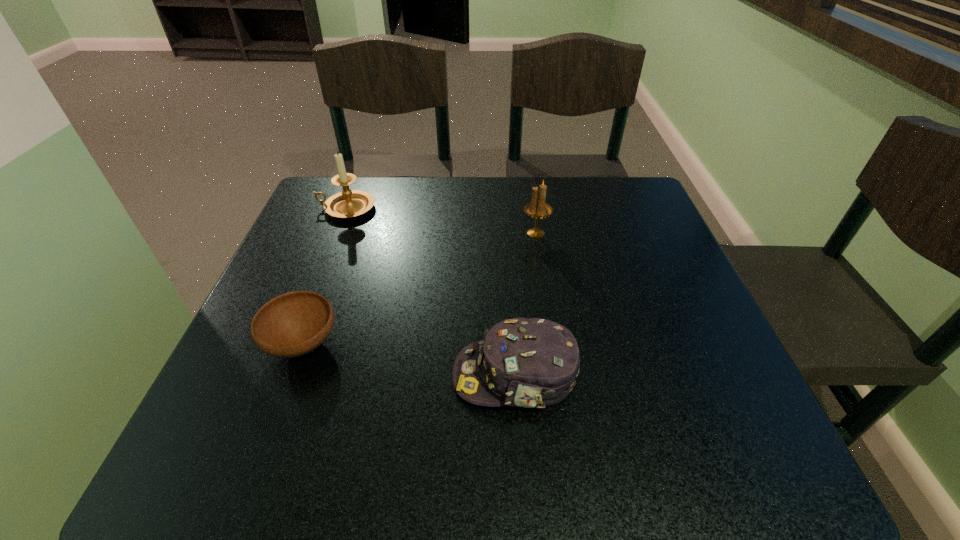
Find the location of `free space that is in between the shortest object and the third tallest object`. free space that is in between the shortest object and the third tallest object is located at coordinates (409, 360).

This screenshot has width=960, height=540. Find the location of `object that is the second closest to the headwear`. object that is the second closest to the headwear is located at coordinates (537, 208).

Select which object is the closest to the nearer candle holder. Please provide its 2D coordinates. Your answer should be formatted as a tuple, i.e. [(x, y)], where the tuple contains the x and y coordinates of a point satisfying the conditions above.

[(532, 363)]

You are a GUI agent. You are given a task and a screenshot of the screen. Output one action in this format:
    pyautogui.click(x=<x>, y=<y>)
    Task: Click on the free space that satisfies the following two spatial constraints: 1. with a handle on the side of the left candle holder; 2. on the left side of the nearer candle holder
    The width and height of the screenshot is (960, 540).
    Given the screenshot: What is the action you would take?
    pyautogui.click(x=336, y=233)

This screenshot has width=960, height=540. What are the coordinates of `free spot that satisfies the following two spatial constraints: 1. on the back side of the shortest object; 2. on the right side of the right candle holder` in the screenshot? It's located at (344, 233).

You are a GUI agent. You are given a task and a screenshot of the screen. Output one action in this format:
    pyautogui.click(x=<x>, y=<y>)
    Task: Click on the free location that satisfies the following two spatial constraints: 1. with a handle on the side of the shortest object; 2. on the left side of the left candle holder
    This screenshot has height=540, width=960.
    Given the screenshot: What is the action you would take?
    pyautogui.click(x=293, y=344)

Identify the location of vacant region that satisfies the following two spatial constraints: 1. with a handle on the side of the farthest object; 2. on the right side of the second farthest object. The image size is (960, 540). (336, 233).

This screenshot has height=540, width=960. What are the coordinates of `vacant point that satisfies the following two spatial constraints: 1. with a handle on the side of the third nearest object; 2. on the left side of the farthest object` in the screenshot? It's located at [x=336, y=233].

Find the location of a particular element. The image size is (960, 540). free point that satisfies the following two spatial constraints: 1. with a handle on the side of the left candle holder; 2. on the back side of the right candle holder is located at coordinates click(x=336, y=233).

Where is `vacant area that satisfies the following two spatial constraints: 1. on the back side of the nearer candle holder; 2. with a handle on the side of the left candle holder`? vacant area that satisfies the following two spatial constraints: 1. on the back side of the nearer candle holder; 2. with a handle on the side of the left candle holder is located at coordinates pyautogui.click(x=532, y=208).